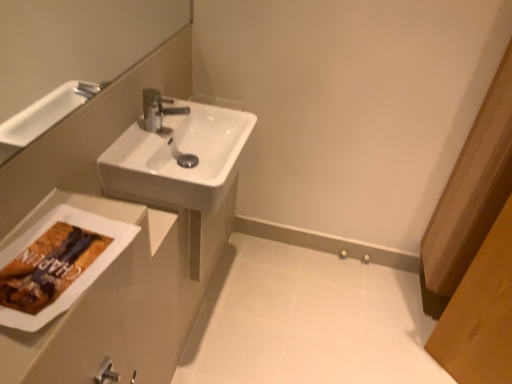
Question: Considering their positions, is white glossy porcelain at center located in front of or behind white glossy sink at center?

Choices:
 (A) front
 (B) behind

Answer: (B)

Question: Considering the relative positions of white glossy porcelain at center and white glossy sink at center in the image provided, is white glossy porcelain at center to the left or to the right of white glossy sink at center?

Choices:
 (A) left
 (B) right

Answer: (B)

Question: From their relative heights in the image, would you say white glossy porcelain at center is taller or shorter than white glossy sink at center?

Choices:
 (A) tall
 (B) short

Answer: (B)

Question: Considering the positions of white glossy sink at center and white glossy porcelain at center in the image, is white glossy sink at center taller or shorter than white glossy porcelain at center?

Choices:
 (A) tall
 (B) short

Answer: (A)

Question: In terms of width, does white glossy sink at center look wider or thinner when compared to white glossy porcelain at center?

Choices:
 (A) wide
 (B) thin

Answer: (B)

Question: From the image's perspective, is white glossy sink at center positioned above or below white glossy porcelain at center?

Choices:
 (A) below
 (B) above

Answer: (B)

Question: Is white glossy sink at center inside the boundaries of white glossy porcelain at center, or outside?

Choices:
 (A) inside
 (B) outside

Answer: (B)